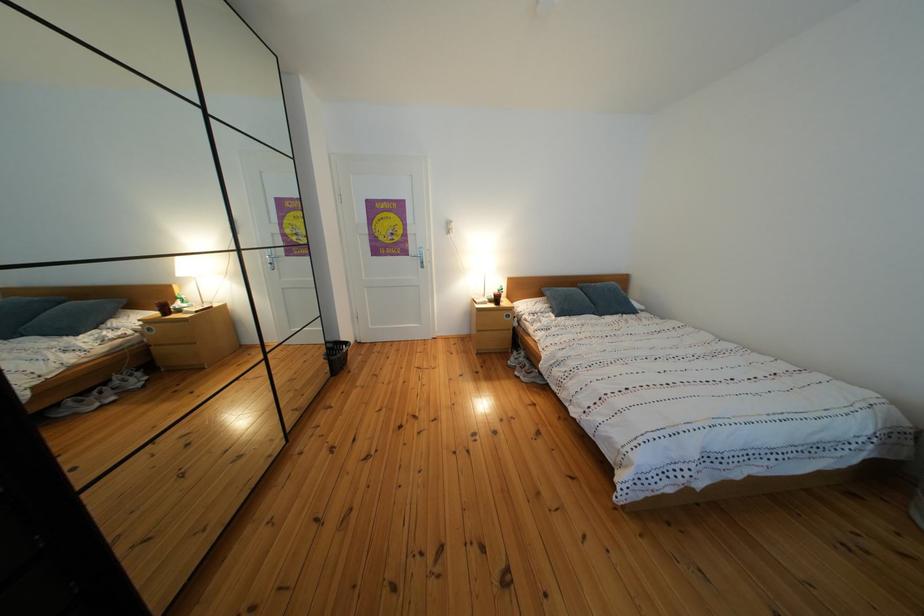
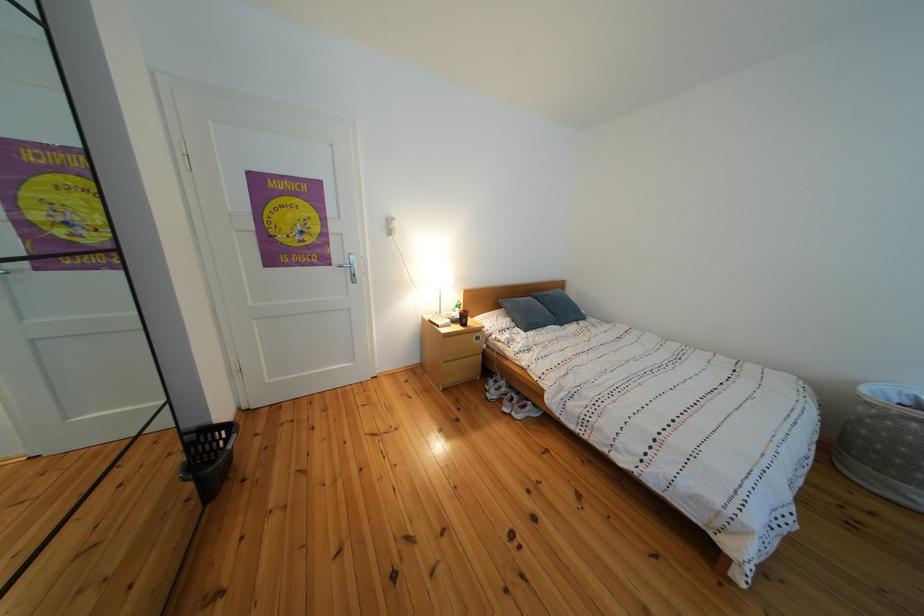
Where in the second image is the point corresponding to point (417, 257) from the first image?

(337, 267)